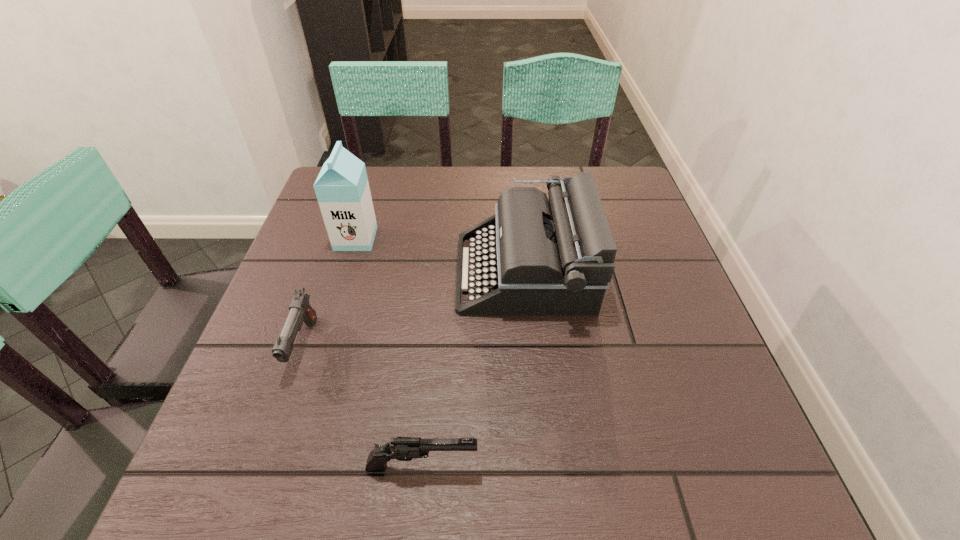
Where is `the tallest object`? This screenshot has width=960, height=540. the tallest object is located at coordinates (342, 189).

Image resolution: width=960 pixels, height=540 pixels. What are the coordinates of `the third shortest object` in the screenshot? It's located at (555, 258).

Where is `the farther gun`? The height and width of the screenshot is (540, 960). the farther gun is located at coordinates (300, 310).

What are the coordinates of `the right gun` in the screenshot? It's located at (401, 448).

What are the coordinates of `the nearer gun` in the screenshot? It's located at click(x=401, y=448).

Locate an element on the screen. vacant region located 0.150m on the back of the tallest object is located at coordinates (370, 193).

The width and height of the screenshot is (960, 540). In order to click on vacant point located on the typing side of the second tallest object in this screenshot , I will do `click(369, 272)`.

Image resolution: width=960 pixels, height=540 pixels. I want to click on free region located on the typing side of the second tallest object, so click(x=289, y=272).

Identify the location of free space located 0.150m on the typing side of the second tallest object. (391, 272).

Locate an element on the screen. This screenshot has height=540, width=960. free location located in the direction the farther gun is aimed is located at coordinates (260, 472).